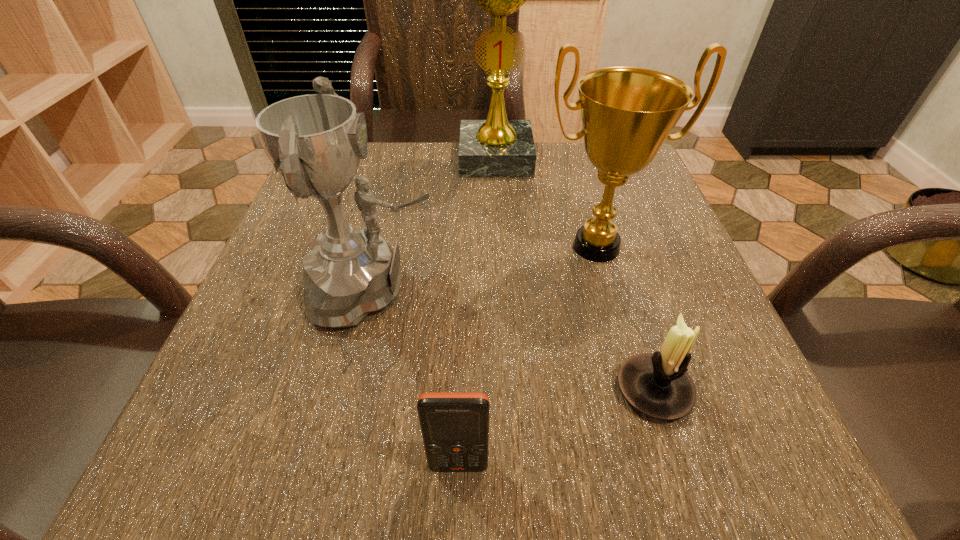
Image resolution: width=960 pixels, height=540 pixels. What are the coordinates of `free space between the candle holder and the farthest object` in the screenshot? It's located at (575, 274).

Identify the location of free spot between the fourth farthest object and the leftmost award. (515, 340).

This screenshot has width=960, height=540. What are the coordinates of `free space between the leftmost object and the second nearest object` in the screenshot? It's located at click(x=515, y=340).

The height and width of the screenshot is (540, 960). Identify the location of free spot between the candle holder and the farthest object. 575,274.

Identify the location of free spot between the leftmost object and the farthest award. The image size is (960, 540). (435, 224).

Identify the location of unoccupied position between the candle holder and the cellular telephone. (556, 428).

Identify the location of empty space between the candle holder and the cellular telephone. Image resolution: width=960 pixels, height=540 pixels. (556, 428).

The height and width of the screenshot is (540, 960). What are the coordinates of `object that is the third closest one to the nearest object` in the screenshot? It's located at (627, 113).

Where is `object that ranks as the second closest to the nearest object`? object that ranks as the second closest to the nearest object is located at coordinates (657, 385).

Identify which award is the third closest to the nearest object. Please provide its 2D coordinates. Your answer should be formatted as a tuple, i.e. [(x, y)], where the tuple contains the x and y coordinates of a point satisfying the conditions above.

[(496, 147)]